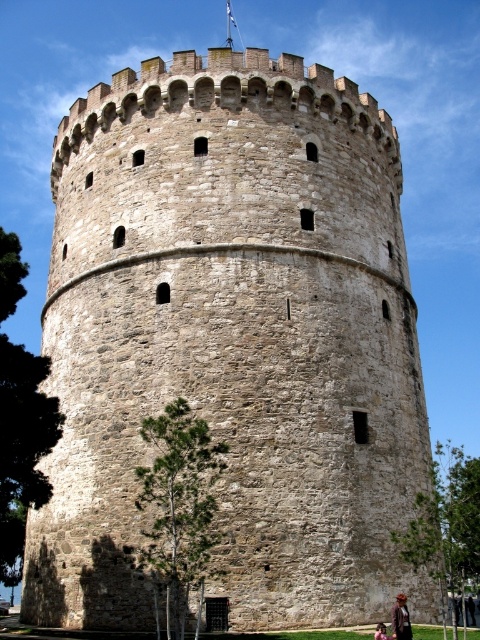
Is brown leather jacket at lower right smaller than brown leather jacket at lower center?

Actually, brown leather jacket at lower right might be larger than brown leather jacket at lower center.

Looking at this image, can you confirm if brown leather jacket at lower right is shorter than brown leather jacket at lower center?

No, brown leather jacket at lower right is not shorter than brown leather jacket at lower center.

Who is more distant from viewer, (x=402, y=612) or (x=379, y=628)?

Point (x=379, y=628)

This screenshot has height=640, width=480. Find the location of `brown leather jacket at lower right`. brown leather jacket at lower right is located at coordinates (400, 618).